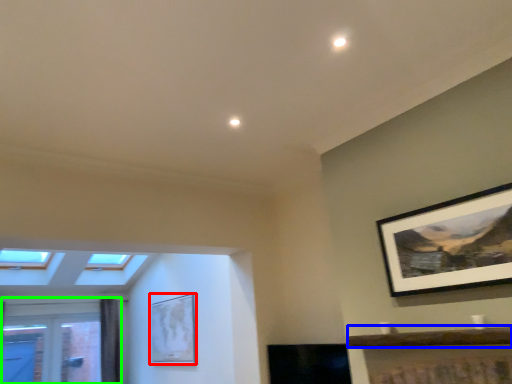
Question: Estimate the real-world distances between objects in this image. Which object is closer to picture frame (highlighted by a red box), window sill (highlighted by a blue box) or window (highlighted by a green box)?

Choices:
 (A) window sill
 (B) window

Answer: (B)